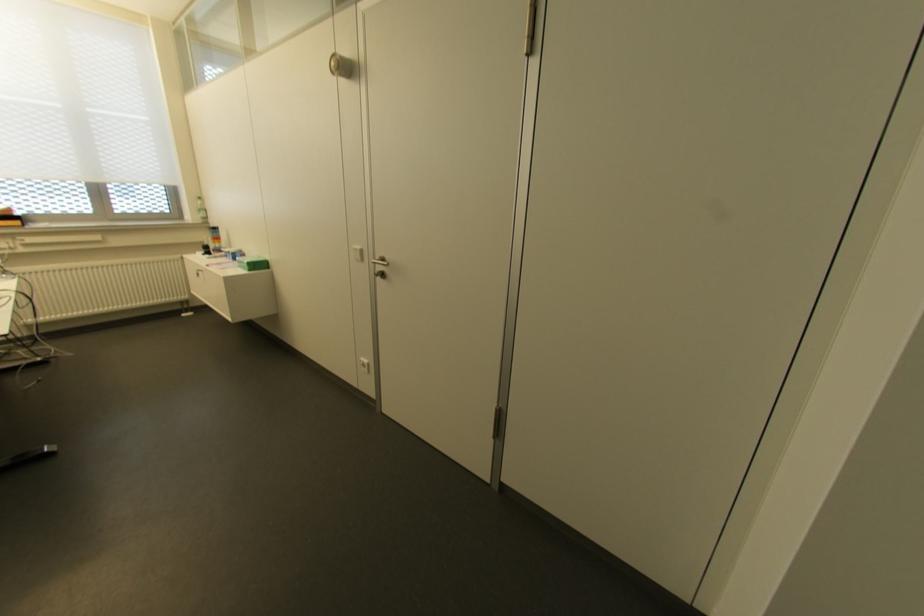
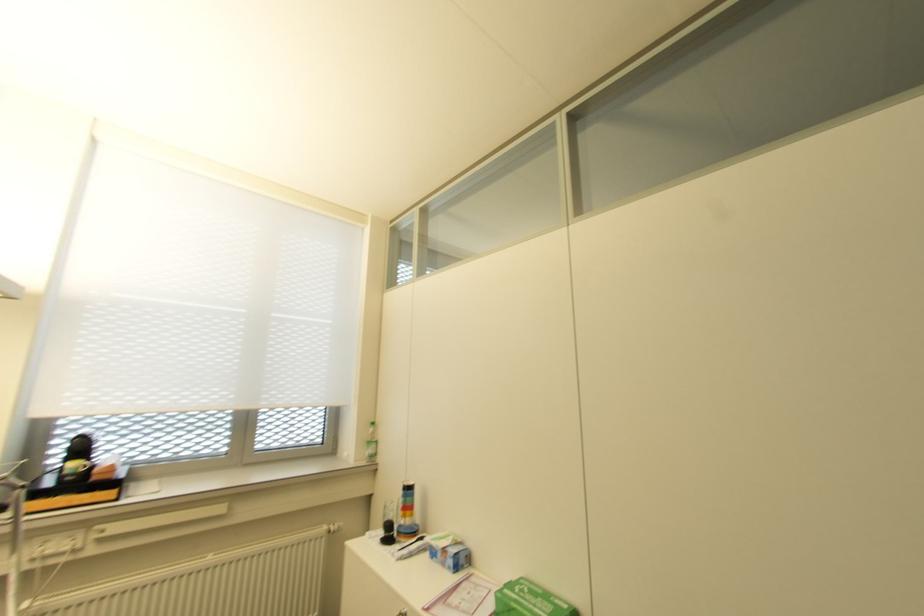
The point at (204, 217) is marked in the first image. Where is the corresponding point in the second image?

(372, 455)